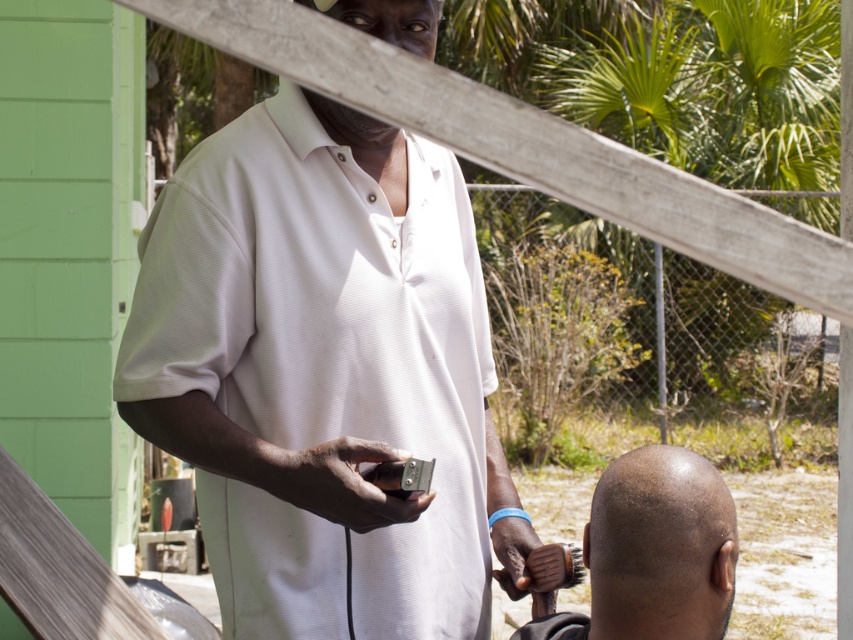
Which is above, white matte shirt at center or bald head at center?

Positioned higher is white matte shirt at center.

Which is behind, point (473, 369) or point (624, 621)?

Positioned behind is point (473, 369).

I want to click on white matte shirt at center, so click(x=325, y=376).